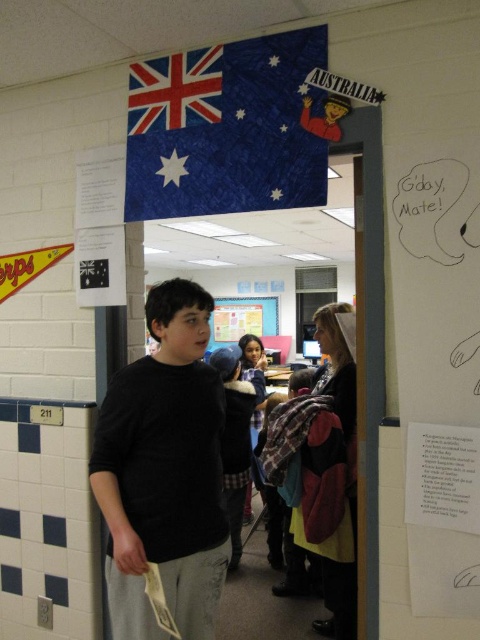
You are standing in the classroom and need to locate the black matte shirt at center. According to the coordinates provided, where should you look?

You should look at point 0.739 on the x axis and 0.342 on the y axis to find the black matte shirt at center.

You are standing in the classroom and need to determine the relative positions of the blue fabric flag at upper center and the plaid fabric shirt at center. Which object is nearer to you?

The blue fabric flag at upper center is closer to the viewer than the plaid fabric shirt at center.

You are a tailor measuring fabrics for a project. You have a piece of fabric that is exactly the same width as the blue fabric flag at upper center. Can the black matte shirt at center be made from this fabric without needing to cut it widthwise?

The black matte shirt at center has a lesser width compared to the blue fabric flag at upper center. Therefore, the fabric piece matching the flag width can accommodate the shirt without needing to cut it widthwise.